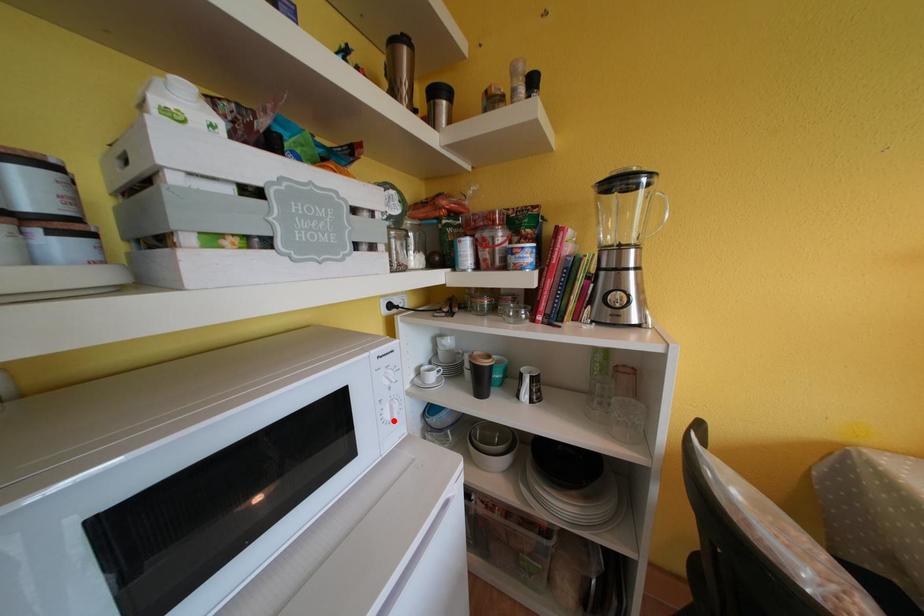
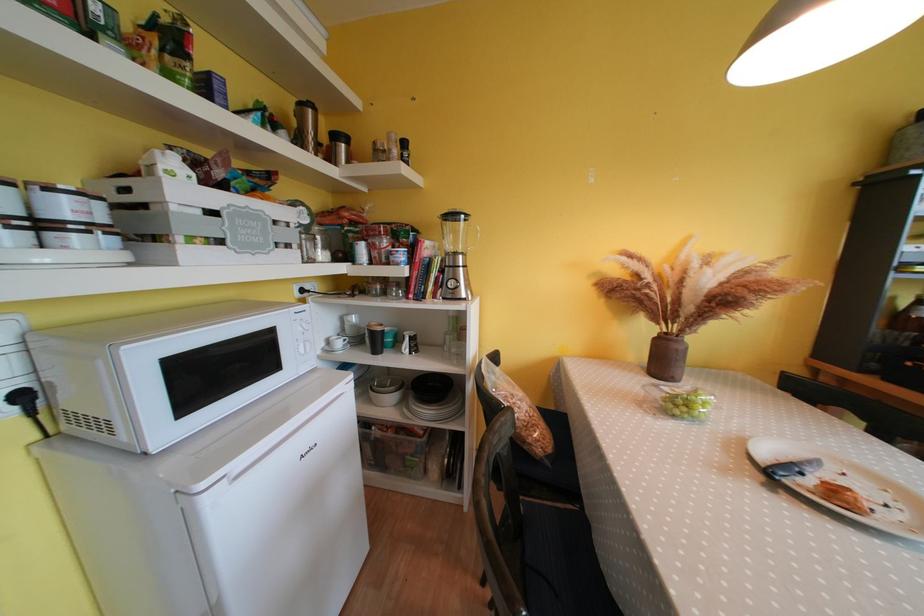
In the second image, find the point that corresponds to the highlighted location in the first image.

(309, 355)